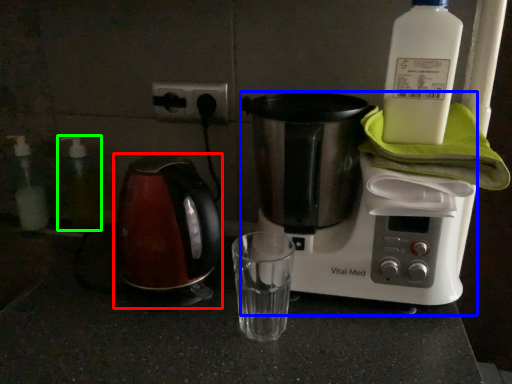
Question: Based on their relative distances, which object is farther from kettle (highlighted by a red box)? Choose from coffee maker (highlighted by a blue box) and bottle (highlighted by a green box).

Choices:
 (A) coffee maker
 (B) bottle

Answer: (B)